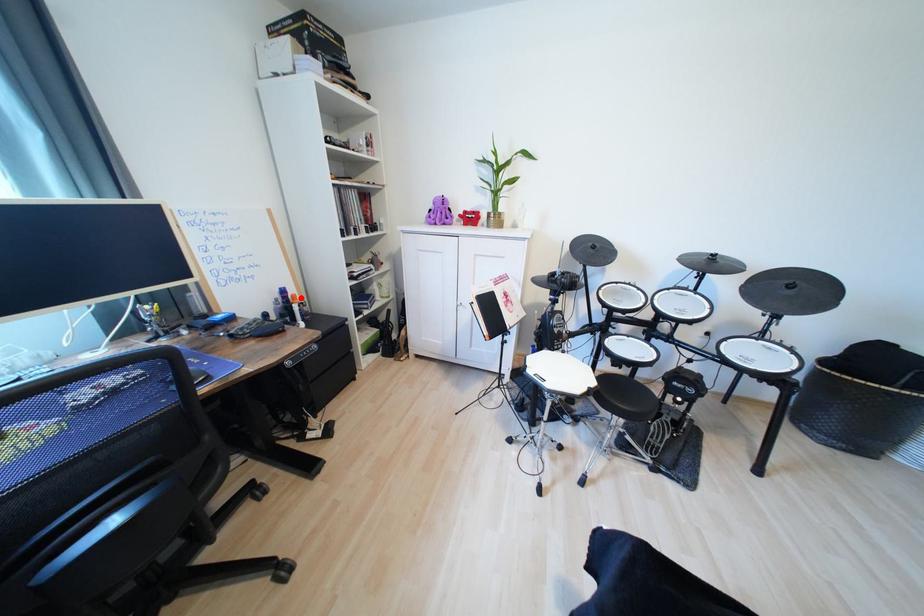
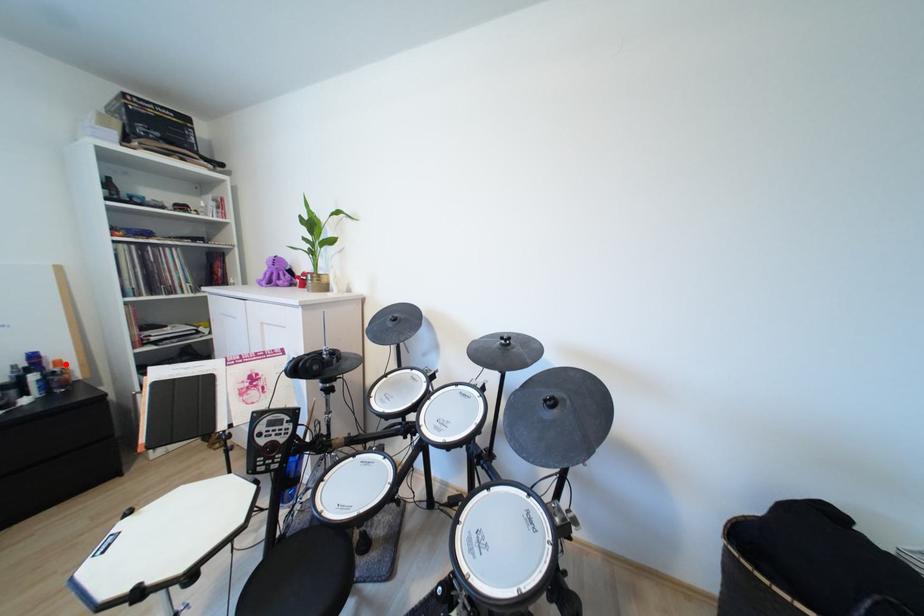
I am providing you with two images of the same scene from different viewpoints. A red point is marked on the first image and another point is marked on the second image. Are the points marked in image1 and image2 representing the same 3D position?

Yes